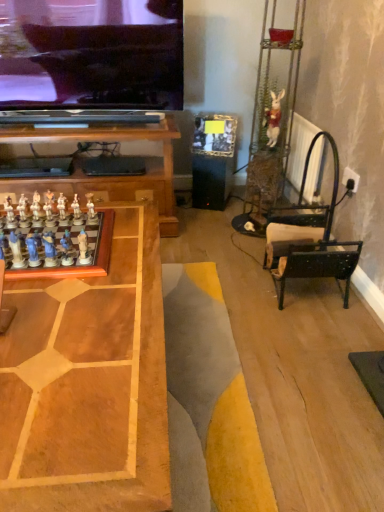
This screenshot has height=512, width=384. Find the location of `vacant space to the right of white glossy chess pieces at left, the ninth toy positioned from the front`. vacant space to the right of white glossy chess pieces at left, the ninth toy positioned from the front is located at coordinates (120, 223).